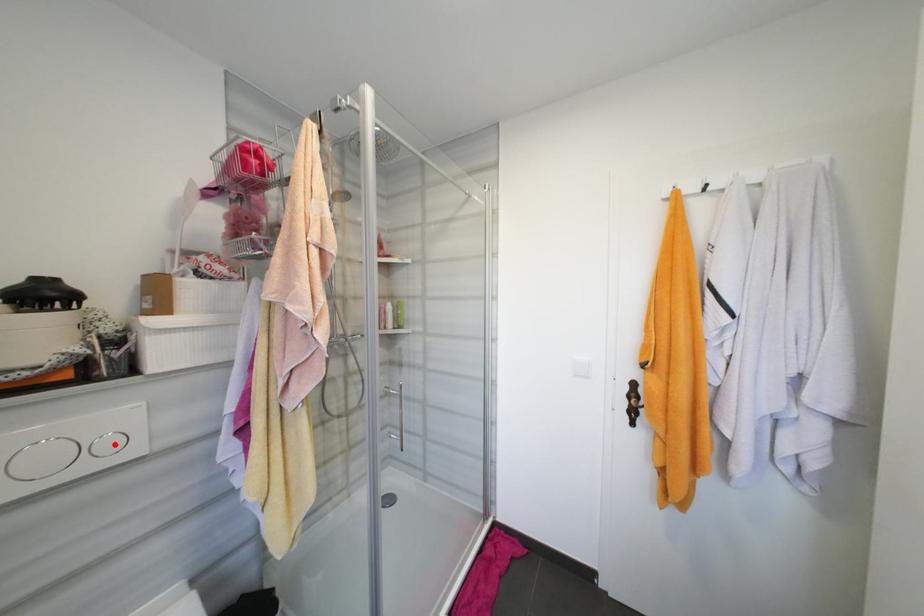
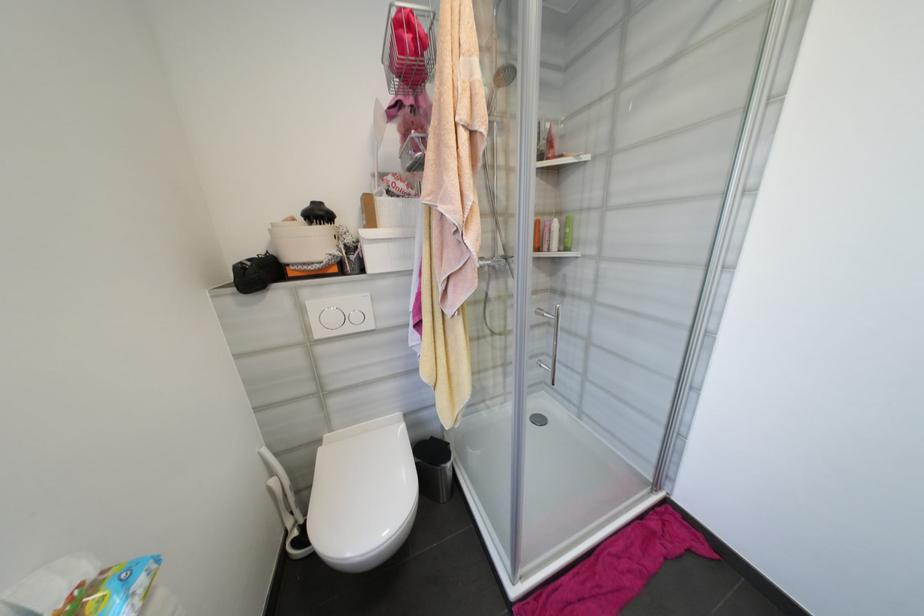
Where in the second image is the point corresponding to the highlighted location from the first image?

(361, 318)